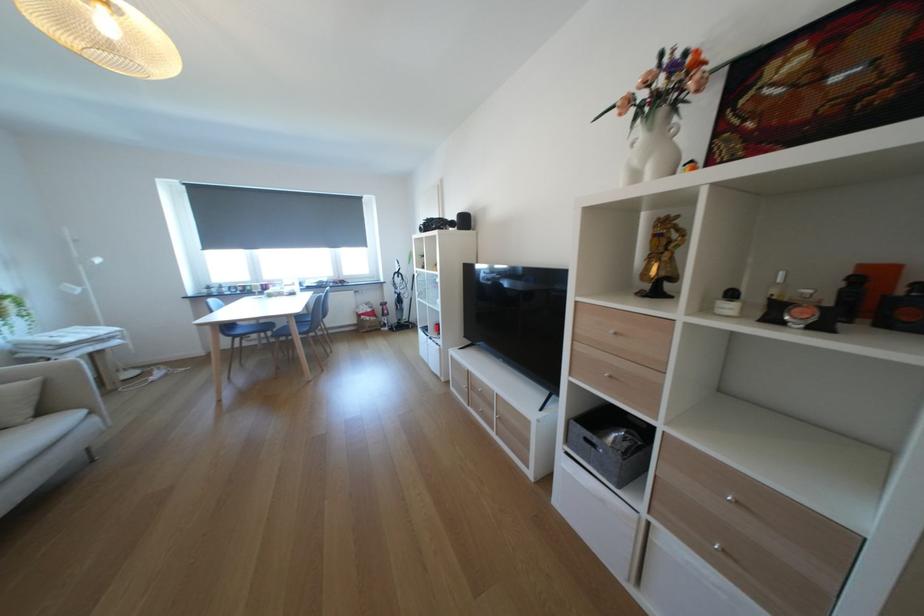
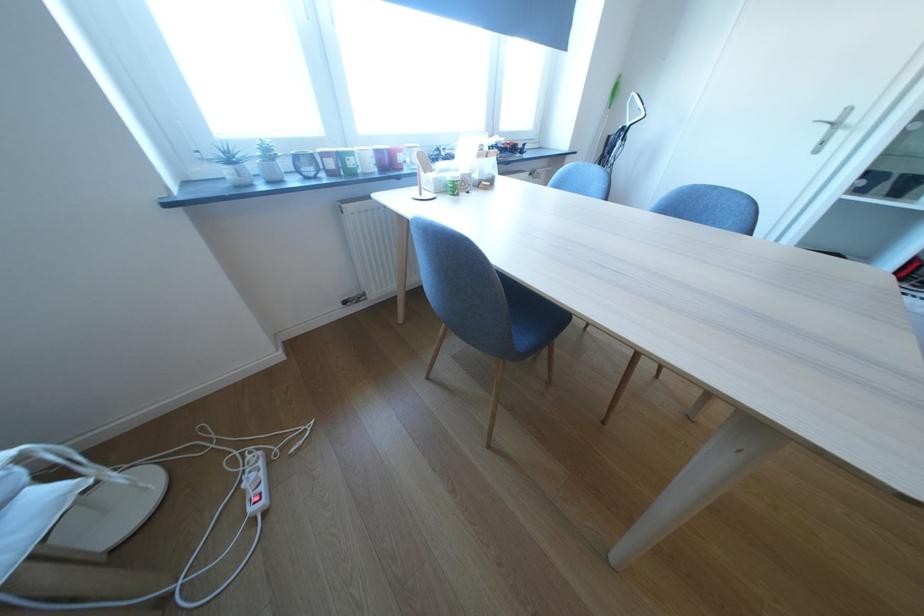
Locate, in the second image, the point that corresponds to [240,288] in the first image.

(308, 160)